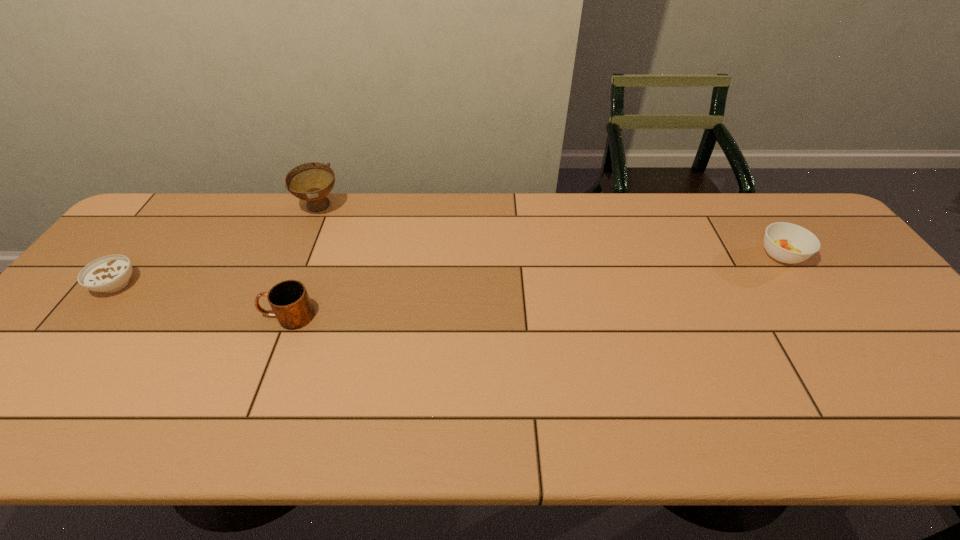
Where is `blank region between the tallest soup bowl and the shortest object`? The height and width of the screenshot is (540, 960). blank region between the tallest soup bowl and the shortest object is located at coordinates (218, 246).

The height and width of the screenshot is (540, 960). In order to click on free space between the tallest object and the mug in this screenshot , I will do `click(303, 262)`.

Locate an element on the screen. The image size is (960, 540). vacant area that lies between the shortest object and the tallest object is located at coordinates (218, 246).

The width and height of the screenshot is (960, 540). In order to click on empty space between the mug and the tallest soup bowl in this screenshot , I will do `click(303, 262)`.

Identify the location of vacant space that's between the nearest object and the rightmost soup bowl. (535, 286).

I want to click on free space between the leftmost object and the farthest soup bowl, so [218, 246].

At what (x,y) coordinates should I click in order to perform the action: click on free spot between the rightmost object and the tallest object. Please return your answer as a coordinate pair (x, y). The height and width of the screenshot is (540, 960). Looking at the image, I should click on (550, 231).

Find the location of a particular element. free area in between the tallest soup bowl and the shortest object is located at coordinates (218, 246).

This screenshot has height=540, width=960. In order to click on unoccupied position between the leftmost object and the rightmost object in this screenshot , I will do `click(448, 269)`.

Find the location of a particular element. vacant point located between the rightmost object and the mug is located at coordinates (535, 286).